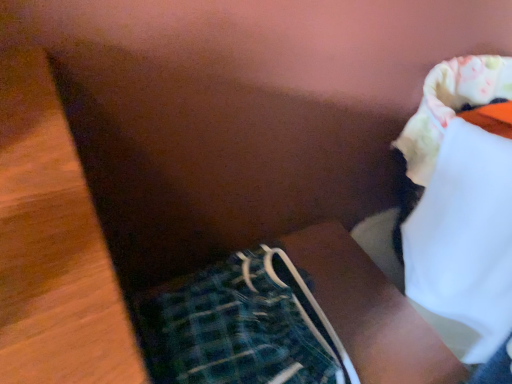
Find the location of `green plaid pants at lower center`. green plaid pants at lower center is located at coordinates (239, 326).

The height and width of the screenshot is (384, 512). Describe the element at coordinates (239, 326) in the screenshot. I see `green plaid pants at lower center` at that location.

Locate an element on the screen. The height and width of the screenshot is (384, 512). green plaid pants at lower center is located at coordinates (239, 326).